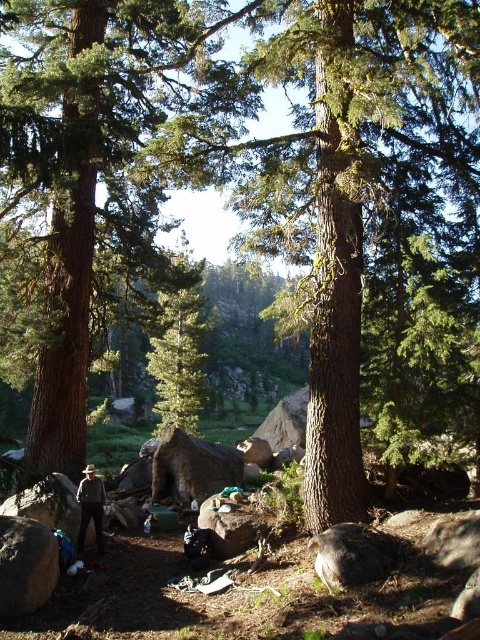
Between green matte tree at center and brown leather hat at lower left, which one appears on the right side from the viewer's perspective?

brown leather hat at lower left is more to the right.

Find the location of a particular element. This screenshot has width=480, height=640. green matte tree at center is located at coordinates (180, 352).

Does point (192, 301) lie in front of point (103, 548)?

That is False.

What are the coordinates of `green matte tree at center` in the screenshot? It's located at (180, 352).